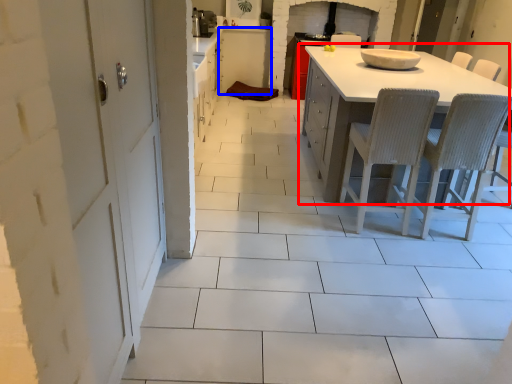
Question: Which point is closer to the camera, table (highlighted by a red box) or cabinetry (highlighted by a blue box)?

Choices:
 (A) table
 (B) cabinetry

Answer: (A)